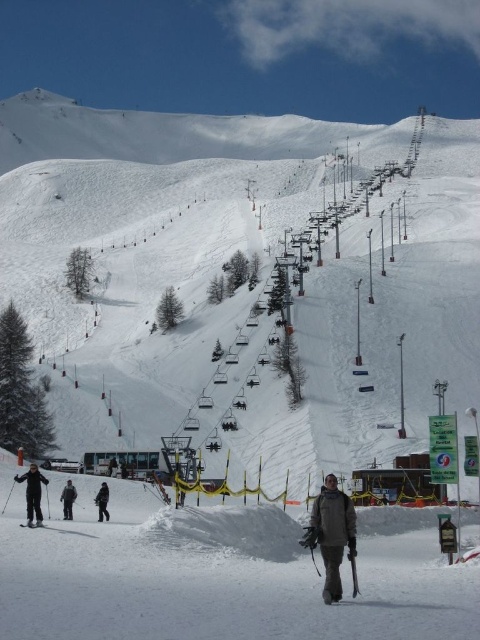
Which is below, black matte skis at lower left or black matte snowboarder at lower left?

black matte snowboarder at lower left

Between point (28, 472) and point (97, 499), which one is positioned in front?

Point (28, 472) is more forward.

You are a GUI agent. You are given a task and a screenshot of the screen. Output one action in this format:
    pyautogui.click(x=<x>, y=<y>)
    Task: Click on the black matte skis at lower left
    This screenshot has width=480, height=640.
    Given the screenshot: What is the action you would take?
    pyautogui.click(x=33, y=493)

Locate an element on the screen. The image size is (480, 640). black matte skis at lower left is located at coordinates (33, 493).

Does black matte skis at lower left have a smaller size compared to black matte jacket at lower left?

Incorrect, black matte skis at lower left is not smaller in size than black matte jacket at lower left.

Between point (29, 496) and point (73, 497), which one is positioned behind?

The point (73, 497) is behind.

Find the location of `black matte skis at lower left`. black matte skis at lower left is located at coordinates (33, 493).

Is the position of dark gray jacket at lower center less distant than that of black matte ski at lower left?

Yes, it is in front of black matte ski at lower left.

Does point (352, 545) come closer to viewer compared to point (36, 525)?

Yes, point (352, 545) is in front of point (36, 525).

Describe the element at coordinates (332, 532) in the screenshot. I see `dark gray jacket at lower center` at that location.

This screenshot has width=480, height=640. In order to click on dark gray jacket at lower center in this screenshot , I will do `click(332, 532)`.